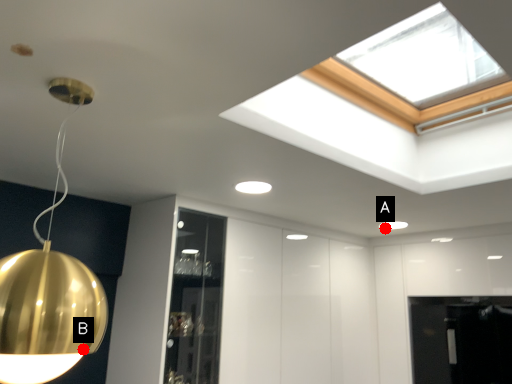
Question: Two points are circled on the image, labeled by A and B beside each circle. Which of the following is the farthest from the observer?

Choices:
 (A) A is further
 (B) B is further

Answer: (A)